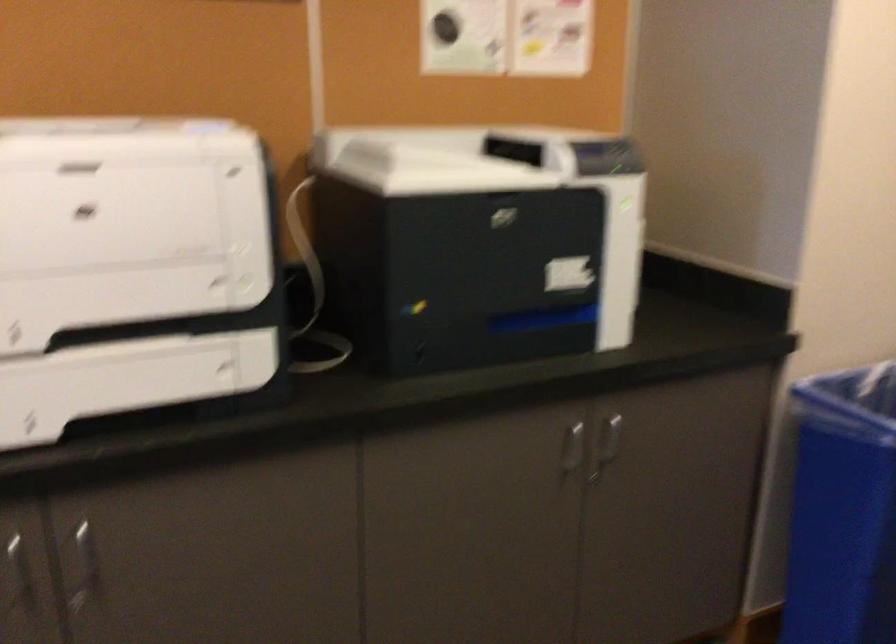
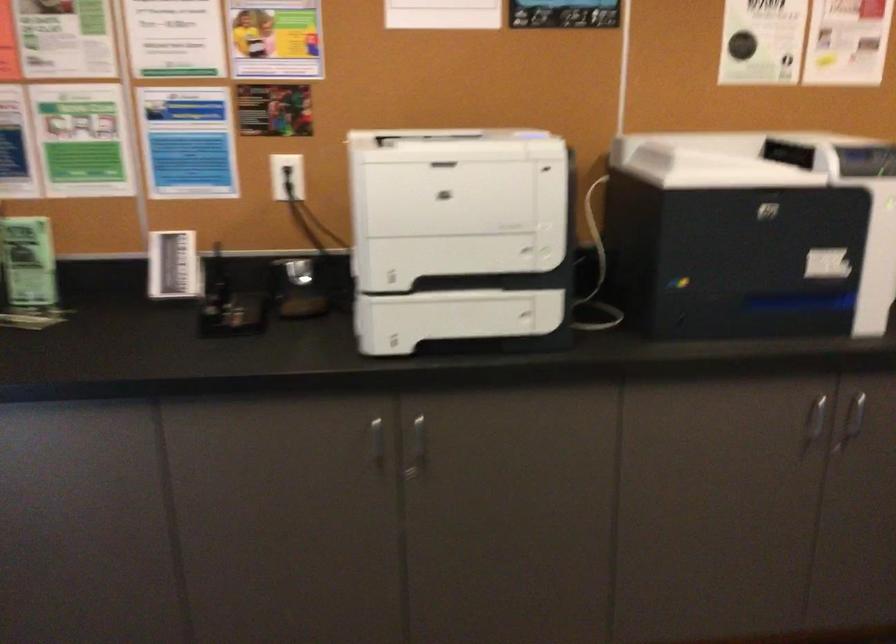
Question: The camera is either moving clockwise (left) or counter-clockwise (right) around the object. The first image is from the beginning of the video and the second image is from the end. Is the camera moving left or right when shooting the video?

Choices:
 (A) Left
 (B) Right

Answer: (B)